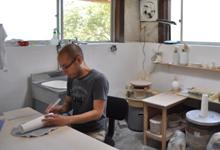
Locate an element on the screen. This screenshot has width=220, height=150. fan to circulate the air is located at coordinates (150, 11).